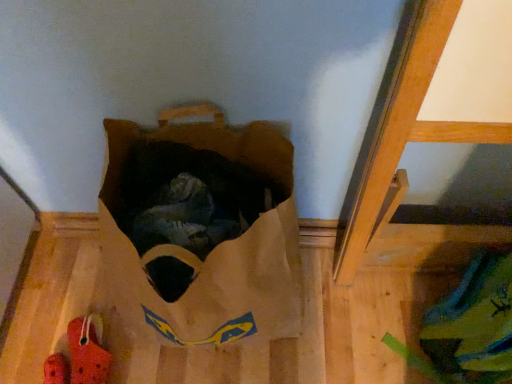
You are a GUI agent. You are given a task and a screenshot of the screen. Output one action in this format:
    pyautogui.click(x=<x>, y=<y>)
    Task: Click on the free space behind rubber/crocodile at lower left
    This screenshot has width=512, height=384.
    Given the screenshot: What is the action you would take?
    pyautogui.click(x=83, y=298)